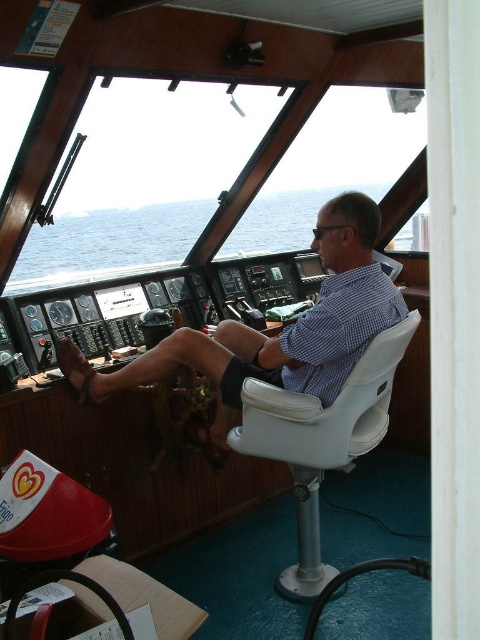
Question: In this image, where is matte blue shirt at center located relative to blue checkered shirt at center?

Choices:
 (A) above
 (B) below

Answer: (B)

Question: Which point appears closest to the camera in this image?

Choices:
 (A) (324, 304)
 (B) (127, 376)
 (C) (335, 460)

Answer: (A)

Question: Is white plastic chair at center further to camera compared to blue checkered shirt at center?

Choices:
 (A) yes
 (B) no

Answer: (B)

Question: Which of the following is the farthest from the observer?

Choices:
 (A) (288, 422)
 (B) (82, 257)
 (C) (372, 333)
 (D) (332, 364)

Answer: (B)

Question: Which of the following is the farthest from the observer?

Choices:
 (A) (300, 477)
 (B) (336, 332)
 (C) (90, 220)

Answer: (C)

Question: Is blue water at center above blue checkered shirt at center?

Choices:
 (A) yes
 (B) no

Answer: (A)